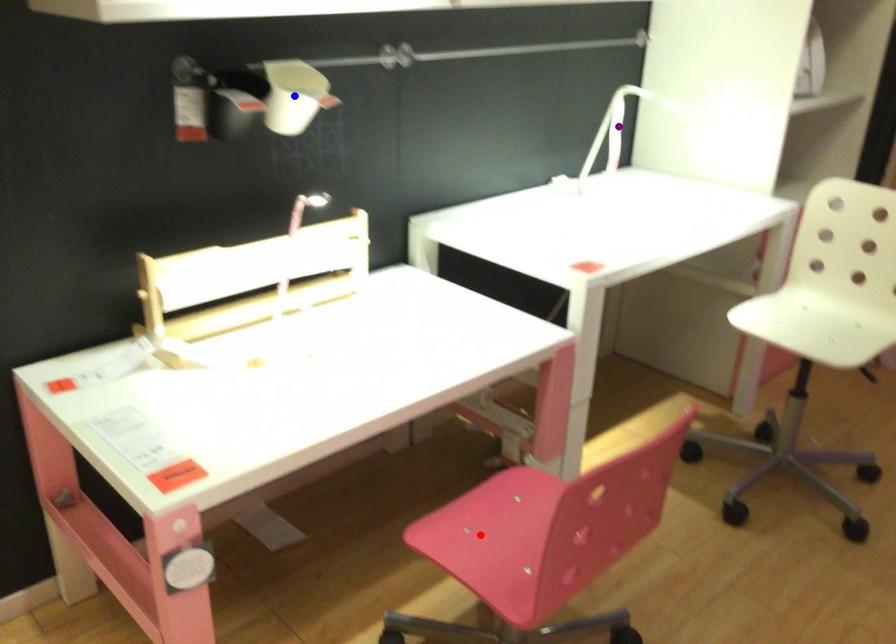
Based on the photo, order these from nearest to farthest:
- purple point
- blue point
- red point

purple point
blue point
red point